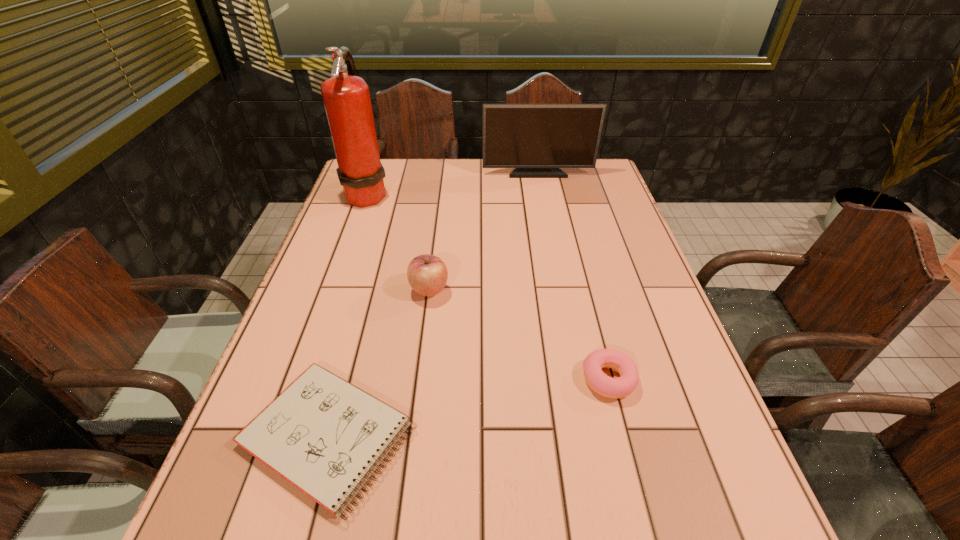
Where is `unoccupied position between the notepad and the apple`? The height and width of the screenshot is (540, 960). unoccupied position between the notepad and the apple is located at coordinates (379, 362).

I want to click on free area in between the notepad and the second tallest object, so coord(433,304).

Where is `free space between the fourth tallest object and the fire extinguisher`? This screenshot has width=960, height=540. free space between the fourth tallest object and the fire extinguisher is located at coordinates (488, 287).

Identify the location of free space between the notepad and the doughnut. The width and height of the screenshot is (960, 540). (468, 407).

Where is `free space between the notepad and the monitor`? free space between the notepad and the monitor is located at coordinates (433, 304).

At what (x,y) coordinates should I click in order to perform the action: click on unoccupied position between the farthest object and the doughnut. Please return your answer as a coordinate pair (x, y). Looking at the image, I should click on (573, 276).

You are a GUI agent. You are given a task and a screenshot of the screen. Output one action in this format:
    pyautogui.click(x=<x>, y=<y>)
    Task: Click on the free space between the shortest object and the doughnut
    This screenshot has width=960, height=540.
    Given the screenshot: What is the action you would take?
    pyautogui.click(x=468, y=407)

You are a GUI agent. You are given a task and a screenshot of the screen. Output one action in this format:
    pyautogui.click(x=<x>, y=<y>)
    Task: Click on the object that is the third nearest to the doughnut
    The height and width of the screenshot is (540, 960).
    Given the screenshot: What is the action you would take?
    pyautogui.click(x=346, y=97)

This screenshot has width=960, height=540. In order to click on the closest object relative to the fourth nearest object in this screenshot , I will do `click(537, 140)`.

This screenshot has height=540, width=960. Identify the location of vacant area in the image that satisfies the following two spatial constraints: 1. on the screen side of the doughnut; 2. on the left side of the farthest object. (578, 380).